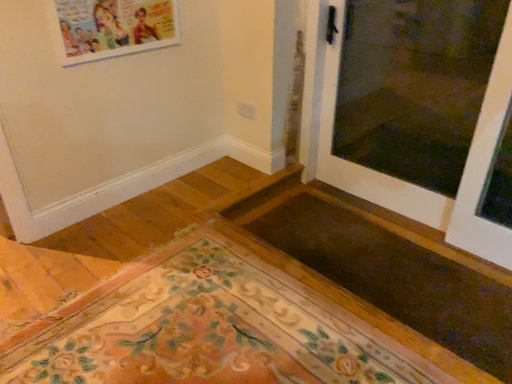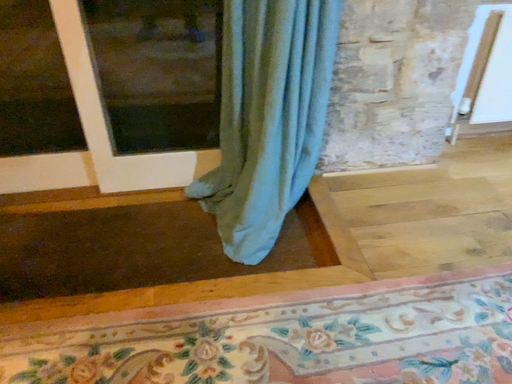
Question: How did the camera likely rotate when shooting the video?

Choices:
 (A) rotated left
 (B) rotated right

Answer: (B)